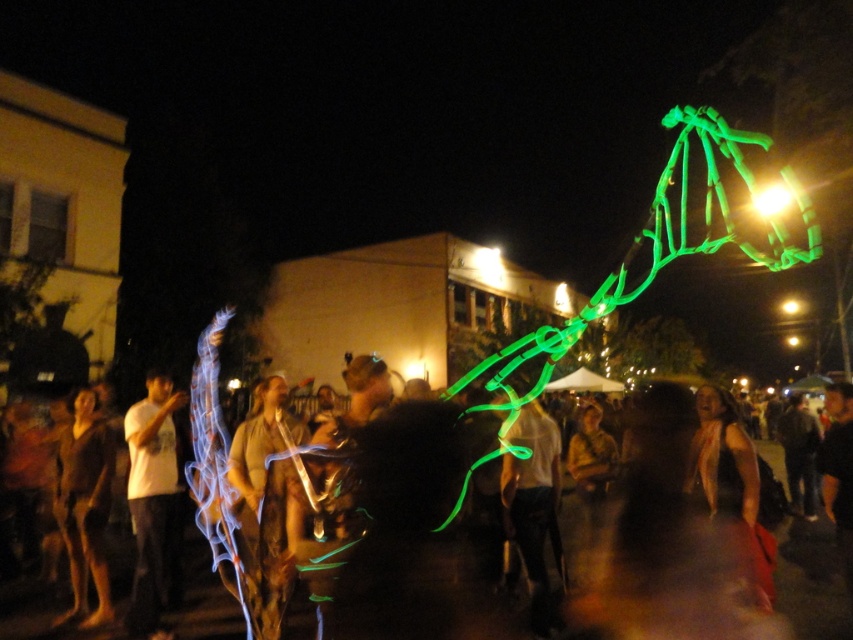
Question: Which point is closer to the camera taking this photo?

Choices:
 (A) 28,589
 (B) 67,544
 (C) 155,516

Answer: (C)

Question: Is the position of translucent fabric at center more distant than that of brown textured fabric at left?

Choices:
 (A) no
 (B) yes

Answer: (A)

Question: Which object appears farthest from the camera in this image?

Choices:
 (A) brown textured fabric at left
 (B) translucent fabric at center

Answer: (A)

Question: Estimate the real-world distances between objects in this image. Which object is closer to the translucent fabric at center?

Choices:
 (A) brown textured fabric at left
 (B) white matte t-shirt at left

Answer: (A)

Question: Is translucent fabric at center bigger than white matte t-shirt at left?

Choices:
 (A) yes
 (B) no

Answer: (A)

Question: Is translucent fabric at center to the left of brown textured fabric at left from the viewer's perspective?

Choices:
 (A) yes
 (B) no

Answer: (B)